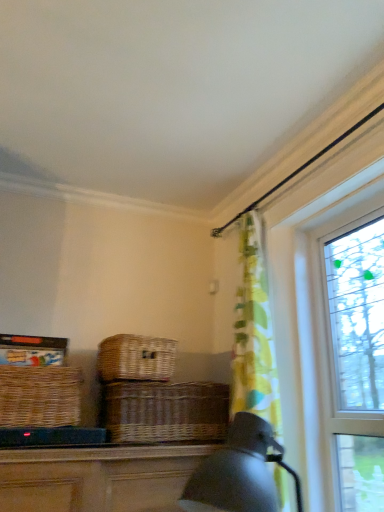
The height and width of the screenshot is (512, 384). What do you see at coordinates (136, 358) in the screenshot? I see `woven brown picnic basket at center, acting as the second picnic basket starting from the left` at bounding box center [136, 358].

Find the location of a particular element. woven brown picnic basket at center, acting as the second picnic basket starting from the left is located at coordinates (136, 358).

Is clear glass window at right oriented towards woven brown picnic basket at left, which ranks as the second picnic basket in right-to-left order?

No, clear glass window at right does not turn towards woven brown picnic basket at left, which ranks as the second picnic basket in right-to-left order.

There is a clear glass window at right. What are the coordinates of `the 2nd picnic basket below it (from the image's perspective)` in the screenshot? It's located at (39, 396).

From a real-world perspective, is clear glass window at right positioned above or below woven brown picnic basket at left, which ranks as the second picnic basket in right-to-left order?

In terms of real-world spatial position, clear glass window at right is above woven brown picnic basket at left, which ranks as the second picnic basket in right-to-left order.

Which is more to the left, brown wicker basket at center or woven brown picnic basket at center, the 1th picnic basket from the right?

Positioned to the left is woven brown picnic basket at center, the 1th picnic basket from the right.

From the image's perspective, starting from the brown wicker basket at center, which picnic basket is the 2nd one above? Please provide its 2D coordinates.

[(136, 358)]

From a real-world perspective, is brown wicker basket at center positioned over woven brown picnic basket at center, the 1th picnic basket from the right, based on gravity?

No.

How many degrees apart are the facing directions of brown wicker basket at center and woven brown picnic basket at center, acting as the second picnic basket starting from the left?

The angle between the facing direction of brown wicker basket at center and the facing direction of woven brown picnic basket at center, acting as the second picnic basket starting from the left, is 5.33 degrees.

Is clear glass window at right oriented away from brown wicker basket at center?

No.

Between clear glass window at right and brown wicker basket at center, which one has smaller width?

With smaller width is clear glass window at right.

Based on the photo, who is smaller, clear glass window at right or brown wicker basket at center?

brown wicker basket at center.

I want to click on window positioned vertically above the woven brown picnic basket at left, which ranks as the second picnic basket in right-to-left order (from a real-world perspective), so click(x=353, y=358).

Is woven brown picnic basket at left, which ranks as the second picnic basket in right-to-left order, positioned with its back to clear glass window at right?

woven brown picnic basket at left, which ranks as the second picnic basket in right-to-left order, is not turned away from clear glass window at right.

Is woven brown picnic basket at left, the 1th picnic basket when ordered from left to right, smaller than clear glass window at right?

Yes.

Do you think brown wicker basket at center is within clear glass window at right, or outside of it?

brown wicker basket at center is located beyond the bounds of clear glass window at right.

From a real-world perspective, does brown wicker basket at center sit lower than clear glass window at right?

Yes, from a real-world perspective, brown wicker basket at center is beneath clear glass window at right.

Is brown wicker basket at center not near clear glass window at right?

They are positioned close to each other.

This screenshot has width=384, height=512. Find the location of `window that is above the woven brown picnic basket at center, the 1th picnic basket from the right (from a real-world perspective)`. window that is above the woven brown picnic basket at center, the 1th picnic basket from the right (from a real-world perspective) is located at coordinates (353, 358).

From the image's perspective, which is below, clear glass window at right or woven brown picnic basket at center, the 1th picnic basket from the right?

woven brown picnic basket at center, the 1th picnic basket from the right.

In the image, is clear glass window at right positioned in front of or behind woven brown picnic basket at center, acting as the second picnic basket starting from the left?

Clearly, clear glass window at right is in front of woven brown picnic basket at center, acting as the second picnic basket starting from the left.

Is clear glass window at right located outside woven brown picnic basket at center, the 1th picnic basket from the right?

Yes.

Between woven brown picnic basket at left, the 1th picnic basket when ordered from left to right, and brown wicker basket at center, which one has larger width?

With larger width is brown wicker basket at center.

Measure the distance from woven brown picnic basket at left, which ranks as the second picnic basket in right-to-left order, to brown wicker basket at center.

woven brown picnic basket at left, which ranks as the second picnic basket in right-to-left order, is 15.97 inches from brown wicker basket at center.

Is woven brown picnic basket at left, the 1th picnic basket when ordered from left to right, oriented towards brown wicker basket at center?

No, woven brown picnic basket at left, the 1th picnic basket when ordered from left to right, is not turned towards brown wicker basket at center.

Is woven brown picnic basket at left, which ranks as the second picnic basket in right-to-left order, not within brown wicker basket at center?

Absolutely, woven brown picnic basket at left, which ranks as the second picnic basket in right-to-left order, is external to brown wicker basket at center.

From the image's perspective, count 2nd picnic baskets downward from the clear glass window at right and point to it. Please provide its 2D coordinates.

[(39, 396)]

I want to click on basket that is on the right side of woven brown picnic basket at center, acting as the second picnic basket starting from the left, so click(165, 412).

Based on their spatial positions, is brown wicker basket at center or woven brown picnic basket at left, which ranks as the second picnic basket in right-to-left order, further from woven brown picnic basket at center, the 1th picnic basket from the right?

woven brown picnic basket at left, which ranks as the second picnic basket in right-to-left order.

Looking at this image, based on their spatial positions, is woven brown picnic basket at left, the 1th picnic basket when ordered from left to right, or woven brown picnic basket at center, the 1th picnic basket from the right, closer to clear glass window at right?

woven brown picnic basket at center, the 1th picnic basket from the right.

Which object lies further to the anchor point woven brown picnic basket at left, the 1th picnic basket when ordered from left to right, brown wicker basket at center or woven brown picnic basket at center, acting as the second picnic basket starting from the left?

brown wicker basket at center is further to woven brown picnic basket at left, the 1th picnic basket when ordered from left to right.

When comparing their distances from brown wicker basket at center, does woven brown picnic basket at left, which ranks as the second picnic basket in right-to-left order, or clear glass window at right seem closer?

The object closer to brown wicker basket at center is woven brown picnic basket at left, which ranks as the second picnic basket in right-to-left order.

Based on their spatial positions, is brown wicker basket at center or woven brown picnic basket at center, acting as the second picnic basket starting from the left, closer to clear glass window at right?

Based on the image, brown wicker basket at center appears to be nearer to clear glass window at right.

Based on their spatial positions, is woven brown picnic basket at center, acting as the second picnic basket starting from the left, or woven brown picnic basket at left, which ranks as the second picnic basket in right-to-left order, further from clear glass window at right?

Based on the image, woven brown picnic basket at left, which ranks as the second picnic basket in right-to-left order, appears to be further to clear glass window at right.

Based on their spatial positions, is woven brown picnic basket at center, the 1th picnic basket from the right, or clear glass window at right closer to brown wicker basket at center?

woven brown picnic basket at center, the 1th picnic basket from the right, lies closer to brown wicker basket at center than the other object.

Looking at the image, which one is located further to woven brown picnic basket at center, acting as the second picnic basket starting from the left, brown wicker basket at center or clear glass window at right?

clear glass window at right.

Identify the location of picnic basket between woven brown picnic basket at left, the 1th picnic basket when ordered from left to right, and brown wicker basket at center, in the horizontal direction. This screenshot has height=512, width=384. (136, 358).

Where is `picnic basket located between woven brown picnic basket at left, which ranks as the second picnic basket in right-to-left order, and clear glass window at right in the left-right direction`? picnic basket located between woven brown picnic basket at left, which ranks as the second picnic basket in right-to-left order, and clear glass window at right in the left-right direction is located at coordinates 136,358.

Where is `basket located between woven brown picnic basket at left, which ranks as the second picnic basket in right-to-left order, and clear glass window at right in the left-right direction`? This screenshot has height=512, width=384. basket located between woven brown picnic basket at left, which ranks as the second picnic basket in right-to-left order, and clear glass window at right in the left-right direction is located at coordinates (165, 412).

The width and height of the screenshot is (384, 512). I want to click on basket between woven brown picnic basket at center, the 1th picnic basket from the right, and clear glass window at right from left to right, so click(165, 412).